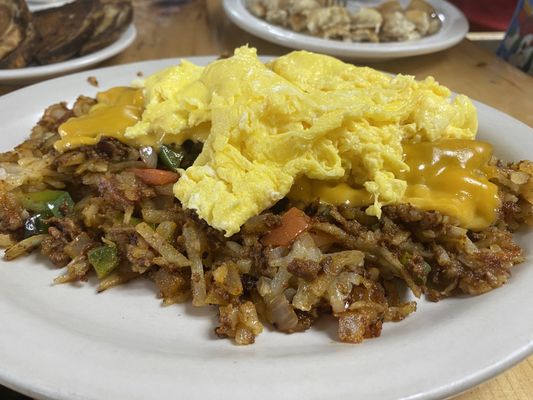
Locate an element on the screen. The height and width of the screenshot is (400, 533). plate is located at coordinates [92, 320], [108, 53], [455, 34].